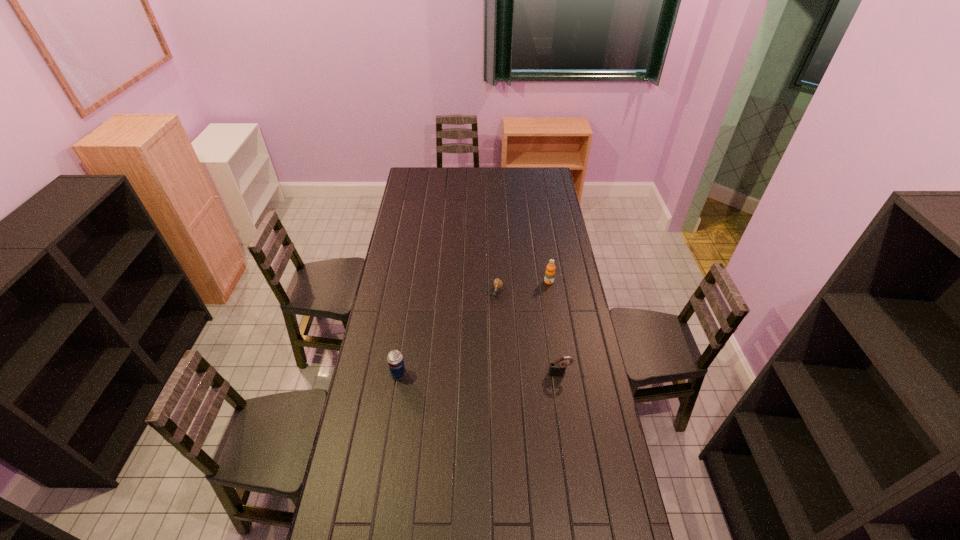
This screenshot has width=960, height=540. I want to click on free space on the desktop that is between the leftmost object and the padlock and is positioned on the label of the orange juice, so click(497, 374).

Identify the location of vacant space on the desktop that is between the leftmost object and the padlock and is positioned on the front-facing side of the escargot. pyautogui.click(x=466, y=374).